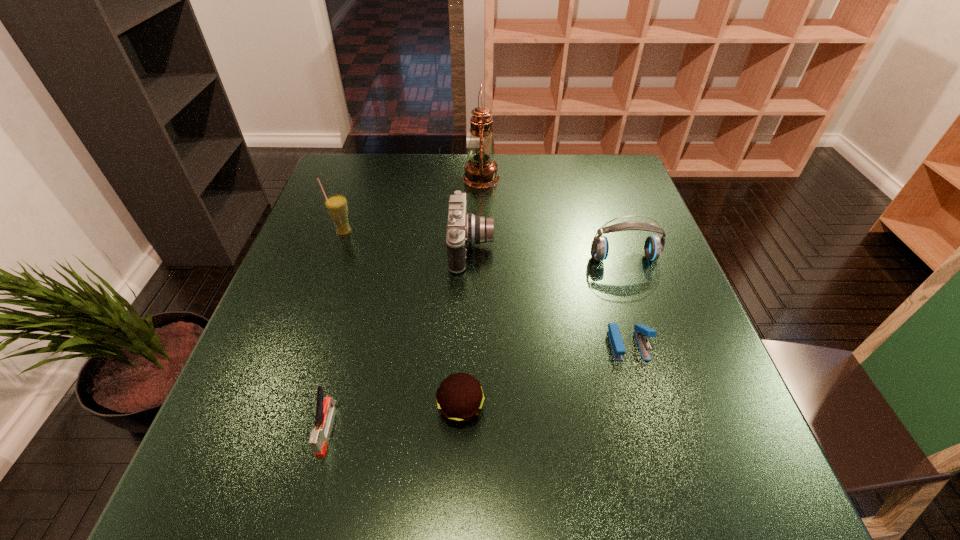
Where is `vacant area that lies between the camera and the farthest object`? vacant area that lies between the camera and the farthest object is located at coordinates (476, 213).

Where is `empty space that is in between the tallest object and the farther stapler`? The width and height of the screenshot is (960, 540). empty space that is in between the tallest object and the farther stapler is located at coordinates (555, 261).

This screenshot has height=540, width=960. Identify the location of free area in between the camera and the patty. (x=466, y=328).

What are the coordinates of `free space between the headset and the second object from left to right` in the screenshot? It's located at (475, 343).

In order to click on free space that is in between the headset and the third shortest object in this screenshot , I will do `click(475, 343)`.

The height and width of the screenshot is (540, 960). I want to click on unoccupied position between the left stapler and the patty, so click(395, 418).

What are the coordinates of `blank region between the leftmost object and the second object from left to right` in the screenshot? It's located at (335, 330).

I want to click on object that is the fifth closest to the patty, so click(x=336, y=205).

Identify which object is located as the third nearest to the taller stapler. Please provide its 2D coordinates. Your answer should be formatted as a tuple, i.e. [(x, y)], where the tuple contains the x and y coordinates of a point satisfying the conditions above.

[(336, 205)]

This screenshot has height=540, width=960. In order to click on vacant space that satisfies the following two spatial constraints: 1. on the back side of the farther stapler; 2. on the right side of the patty in this screenshot , I will do [463, 345].